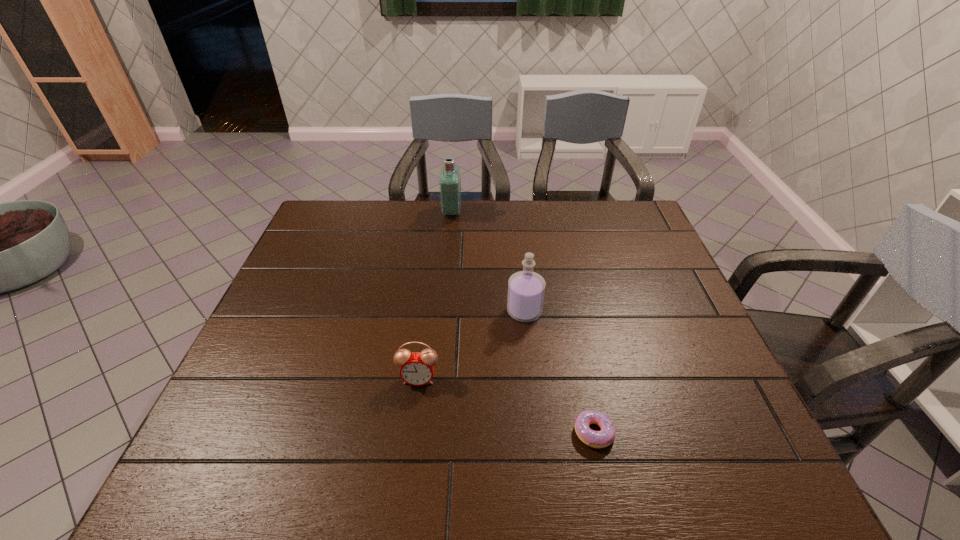
The height and width of the screenshot is (540, 960). Identify the location of the farther perfume. (450, 180).

Find the location of a particular element. Image resolution: width=960 pixels, height=540 pixels. the left perfume is located at coordinates (450, 180).

Find the location of a particular element. This screenshot has height=540, width=960. the third nearest object is located at coordinates (526, 289).

Locate an element on the screen. the third object from left to right is located at coordinates (526, 289).

What are the coordinates of `the third farthest object` in the screenshot? It's located at (417, 368).

Where is `the third tallest object`? This screenshot has height=540, width=960. the third tallest object is located at coordinates (417, 368).

The width and height of the screenshot is (960, 540). I want to click on doughnut, so click(597, 439).

Image resolution: width=960 pixels, height=540 pixels. What are the coordinates of `the nearest object` in the screenshot? It's located at (597, 439).

Locate an element on the screen. free region located 0.270m on the front label of the farthest object is located at coordinates pos(539,212).

You are a GUI agent. You are given a task and a screenshot of the screen. Output one action in this format:
    pyautogui.click(x=<x>, y=<y>)
    Task: Click on the free location located 0.210m on the right of the third object from left to right
    
    Given the screenshot: What is the action you would take?
    pyautogui.click(x=621, y=312)